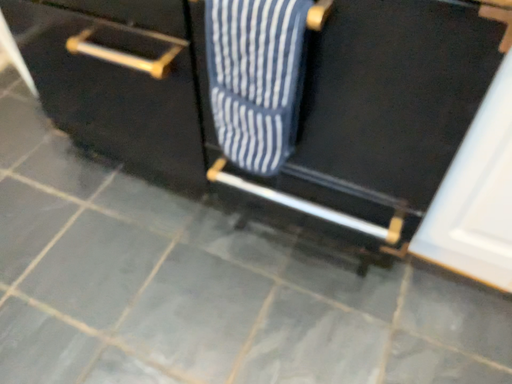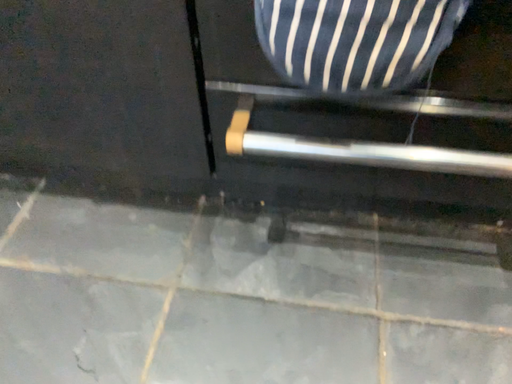
Question: How did the camera likely rotate when shooting the video?

Choices:
 (A) rotated right
 (B) rotated left

Answer: (A)